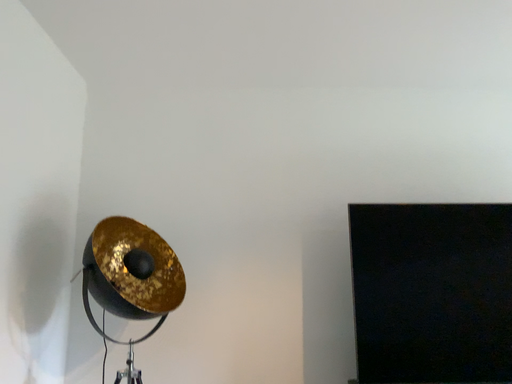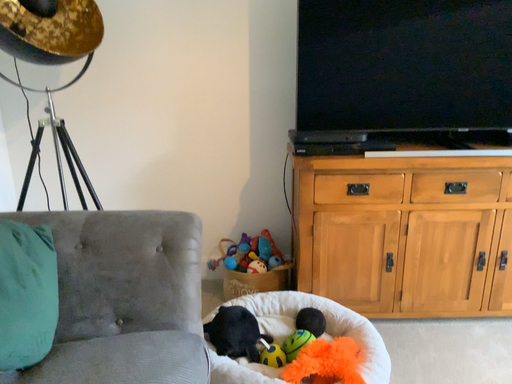
Question: Which way did the camera rotate in the video?

Choices:
 (A) rotated downward
 (B) rotated upward

Answer: (A)